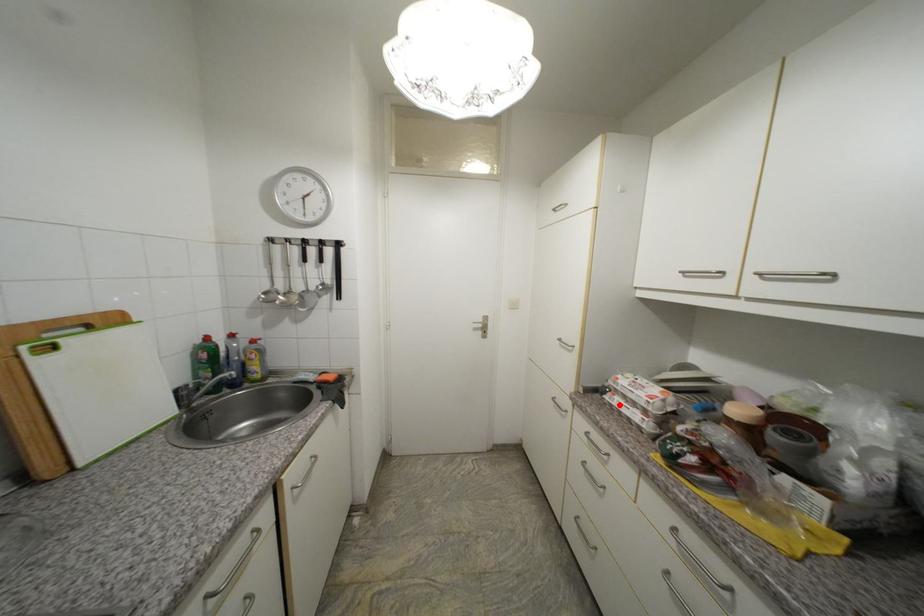
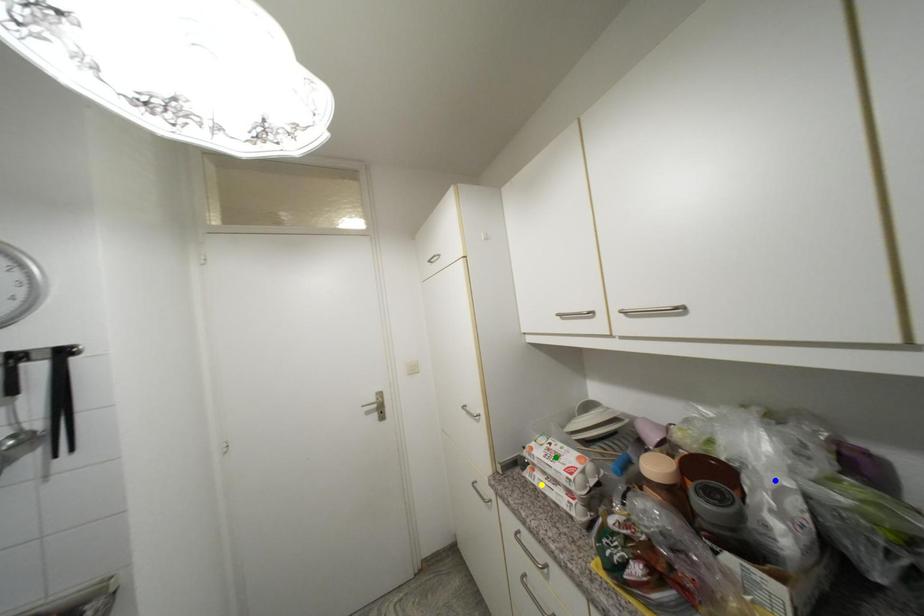
Question: I am providing you with two images of the same scene from different viewpoints. A red point is marked on the first image. You are given multiple points on the second image. Which point in image 2 is actually the same real-world point as the red point in image 1?

Choices:
 (A) green point
 (B) blue point
 (C) yellow point

Answer: (C)